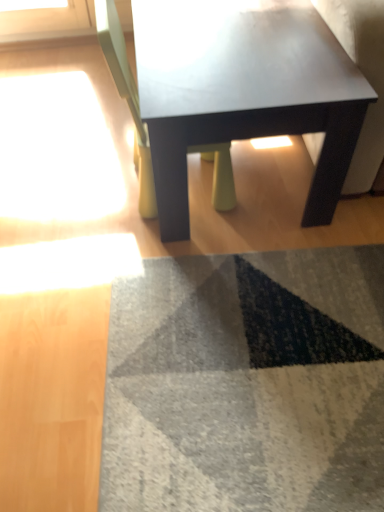
This screenshot has height=512, width=384. I want to click on vacant area on top of matte black coffee table at center (from a real-world perspective), so click(x=244, y=36).